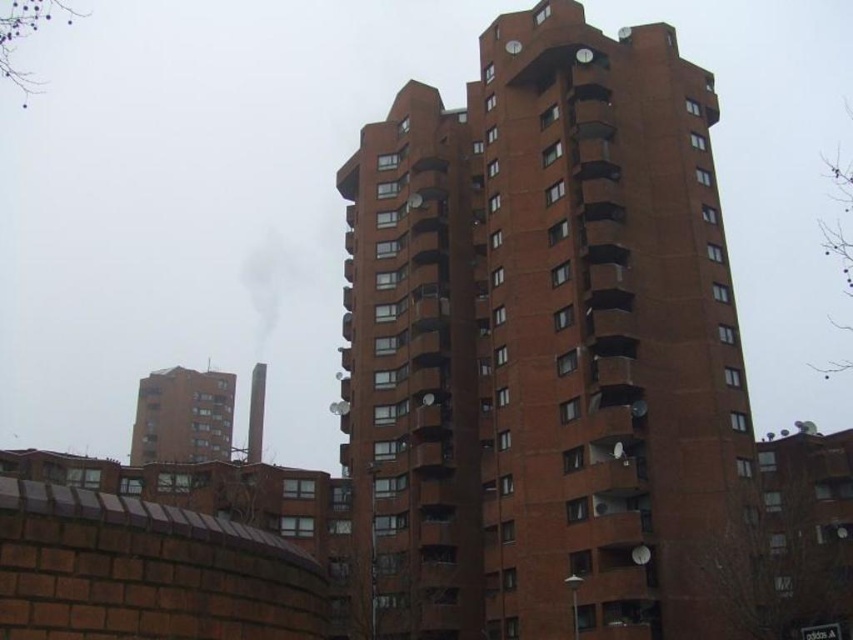
You are an architect analyzing the building layout. You need to determine which object, the brick tower block at center or the smooth gray chimney at center, would cast a longer shadow at noon. Based on their positions, which one do you think it would be?

The brick tower block at center is closer to the viewer than the smooth gray chimney at center, so the brick tower block at center would cast a longer shadow at noon because it is positioned closer to the viewer and thus taller in the image.

You are standing at the point marked by coordinates point (x=543, y=344). What is the name of the structure you are currently located in?

The structure you are located in is the brick tower block at center, as indicated by the point (x=543, y=344).

You are a drone operator who needs to fly a drone from the top of the brick tower block at center to the top of the smooth gray chimney at center. Based on the scene, will the drone need to ascend or descend during this flight?

The brick tower block at center has a greater height compared to the smooth gray chimney at center. Therefore, the drone will need to descend while flying from the top of the brick tower block at center to the top of the smooth gray chimney at center.